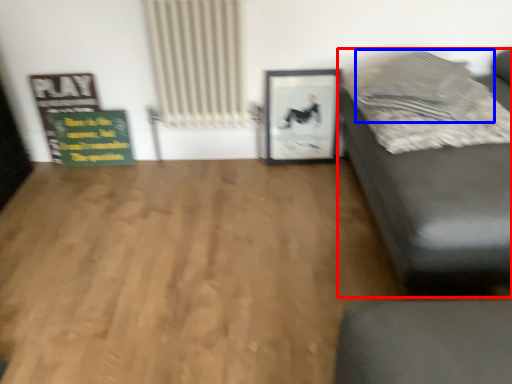
Question: Which object appears closest to the camera in this image, studio couch (highlighted by a red box) or pillow (highlighted by a blue box)?

Choices:
 (A) studio couch
 (B) pillow

Answer: (A)